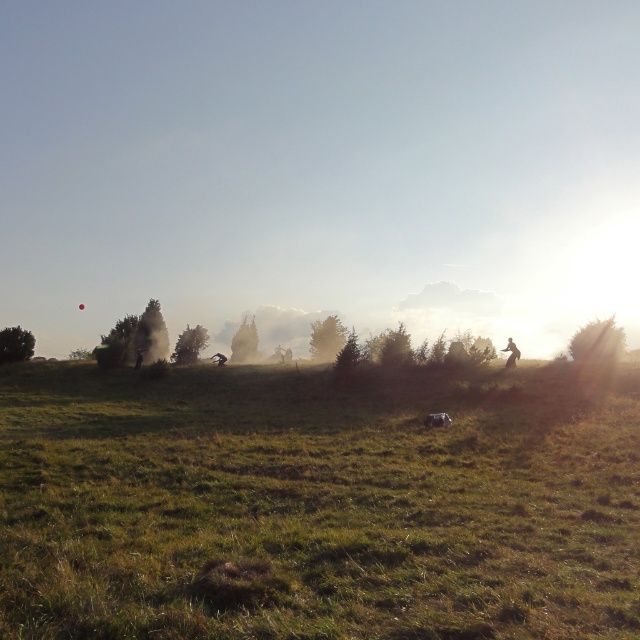
Question: Is green grassy field at center below silhouette figure at right?

Choices:
 (A) yes
 (B) no

Answer: (A)

Question: Is green grassy field at center in front of silhouette figure at right?

Choices:
 (A) no
 (B) yes

Answer: (B)

Question: Can you confirm if green grassy field at center is positioned to the left of silhouette figure at right?

Choices:
 (A) no
 (B) yes

Answer: (B)

Question: Among these points, which one is farthest from the camera?

Choices:
 (A) (164, 564)
 (B) (513, 348)

Answer: (B)